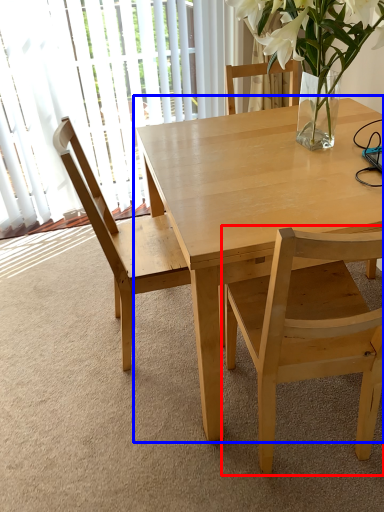
Question: Which point is closer to the camera, chair (highlighted by a red box) or kitchen & dining room table (highlighted by a blue box)?

Choices:
 (A) chair
 (B) kitchen & dining room table

Answer: (A)